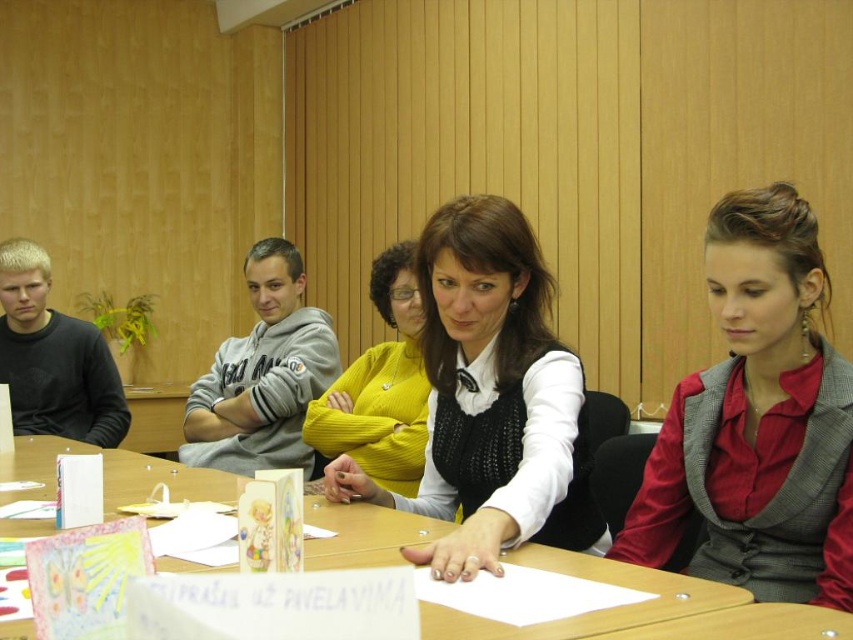
Who is positioned more to the left, red fabric vest at center or matte yellow sweater at center?

matte yellow sweater at center

Which is behind, point (669, 522) or point (364, 378)?

Point (364, 378)

Where is `red fabric vest at center`? red fabric vest at center is located at coordinates (757, 420).

Between wooden table at center and gray fleece sweatshirt at center, which one is positioned higher?

gray fleece sweatshirt at center is higher up.

Does wooden table at center appear on the left side of gray fleece sweatshirt at center?

Correct, you'll find wooden table at center to the left of gray fleece sweatshirt at center.

The width and height of the screenshot is (853, 640). I want to click on wooden table at center, so click(590, 612).

Identify the location of wooden table at center. The width and height of the screenshot is (853, 640). (590, 612).

Between matte black vest at center and matte yellow sweater at center, which one appears on the left side from the viewer's perspective?

matte yellow sweater at center is more to the left.

Between matte black vest at center and matte yellow sweater at center, which one has more height?

Standing taller between the two is matte yellow sweater at center.

Where is `matte black vest at center`? matte black vest at center is located at coordinates (490, 397).